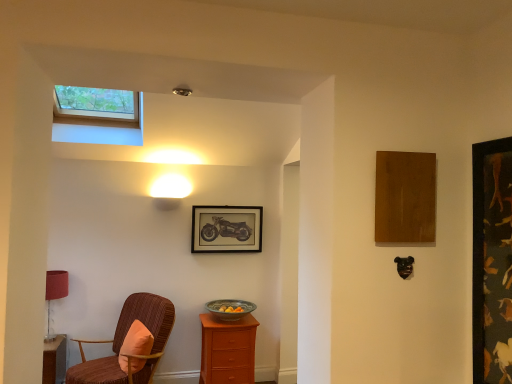
Question: Does earthy ceramic bowl at center have a lesser width compared to velvet brown chair with orange cushion at left?

Choices:
 (A) no
 (B) yes

Answer: (B)

Question: Is the depth of earthy ceramic bowl at center greater than that of velvet brown chair with orange cushion at left?

Choices:
 (A) yes
 (B) no

Answer: (A)

Question: From the image's perspective, is earthy ceramic bowl at center located above velvet brown chair with orange cushion at left?

Choices:
 (A) no
 (B) yes

Answer: (B)

Question: From a real-world perspective, is earthy ceramic bowl at center below velvet brown chair with orange cushion at left?

Choices:
 (A) yes
 (B) no

Answer: (B)

Question: Can you confirm if earthy ceramic bowl at center is shorter than velvet brown chair with orange cushion at left?

Choices:
 (A) yes
 (B) no

Answer: (A)

Question: Would you say orange fabric pillow at lower left is to the left or to the right of dark wood picture frame at right, the 1th picture frame in the right-to-left sequence, in the picture?

Choices:
 (A) left
 (B) right

Answer: (A)

Question: Is point (136, 336) positioned closer to the camera than point (496, 175)?

Choices:
 (A) closer
 (B) farther

Answer: (B)

Question: From the image's perspective, is orange fabric pillow at lower left positioned above or below dark wood picture frame at right, marked as the 1th picture frame in a front-to-back arrangement?

Choices:
 (A) above
 (B) below

Answer: (B)

Question: In the image, is orange fabric pillow at lower left positioned in front of or behind dark wood picture frame at right, marked as the 1th picture frame in a front-to-back arrangement?

Choices:
 (A) front
 (B) behind

Answer: (B)

Question: From the image's perspective, is matte black motorcycle at center, acting as the second picture frame starting from the front, located above or below wooden nightstand at center?

Choices:
 (A) above
 (B) below

Answer: (A)

Question: From their relative heights in the image, would you say matte black motorcycle at center, marked as the second picture frame in a right-to-left arrangement, is taller or shorter than wooden nightstand at center?

Choices:
 (A) short
 (B) tall

Answer: (A)

Question: Do you think matte black motorcycle at center, which appears as the first picture frame when viewed from the left, is within wooden nightstand at center, or outside of it?

Choices:
 (A) outside
 (B) inside

Answer: (A)

Question: From a real-world perspective, is matte black motorcycle at center, marked as the second picture frame in a right-to-left arrangement, physically located above or below wooden nightstand at center?

Choices:
 (A) above
 (B) below

Answer: (A)

Question: From their relative heights in the image, would you say velvet brown chair with orange cushion at left is taller or shorter than matte black motorcycle at center, the 1th picture frame when ordered from back to front?

Choices:
 (A) tall
 (B) short

Answer: (A)

Question: Is point pos(141,301) positioned closer to the camera than point pos(197,248)?

Choices:
 (A) farther
 (B) closer

Answer: (B)